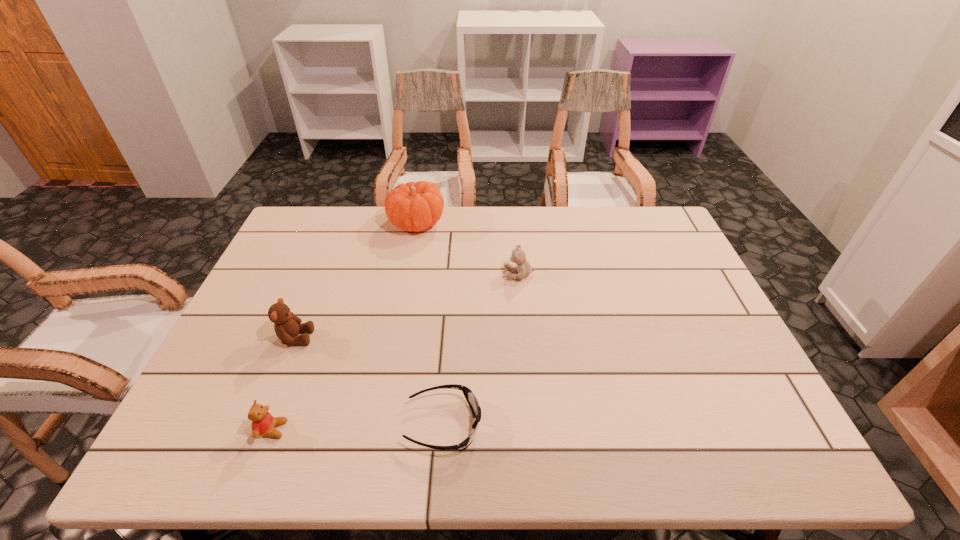
Locate an element on the screen. This screenshot has width=960, height=540. vacant point located on the face of the farthest teddy bear is located at coordinates (410, 274).

The height and width of the screenshot is (540, 960). Find the location of `vacant point located 0.180m on the face of the farthest teddy bear`. vacant point located 0.180m on the face of the farthest teddy bear is located at coordinates (444, 274).

Find the location of a particular element. The image size is (960, 540). vacant space located on the front-facing side of the nearest teddy bear is located at coordinates (366, 429).

Find the location of a particular element. This screenshot has height=540, width=960. vacant space located 0.330m on the lenses of the sunglasses is located at coordinates (635, 425).

At what (x,y) coordinates should I click in order to perform the action: click on object situated at the far edge. Please return your answer as a coordinate pair (x, y). Image resolution: width=960 pixels, height=540 pixels. Looking at the image, I should click on (413, 206).

In order to click on teddy bear present at the near edge in this screenshot , I will do `click(263, 423)`.

Locate an element on the screen. The width and height of the screenshot is (960, 540). sunglasses at the near edge is located at coordinates [x=473, y=403].

The width and height of the screenshot is (960, 540). Find the location of `object that is positioned at the left edge`. object that is positioned at the left edge is located at coordinates (287, 326).

This screenshot has width=960, height=540. I want to click on free region at the far edge of the desktop, so click(x=588, y=242).

Identify the location of vacant area at the near edge of the desktop. (661, 442).